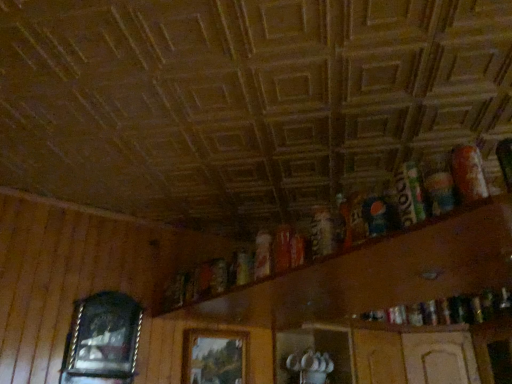
Question: Is wooden shelf at upper right, the 1th shelf from the right, at the right side of wooden picture frame at left, the 1th picture frame from the left?

Choices:
 (A) no
 (B) yes

Answer: (B)

Question: Can we say wooden shelf at upper right, the 2th shelf in the left-to-right sequence, lies outside wooden picture frame at left, the 1th picture frame from the left?

Choices:
 (A) no
 (B) yes

Answer: (B)

Question: Is wooden shelf at upper right, the 1th shelf from the right, in front of wooden picture frame at left, which is the 2th picture frame from right to left?

Choices:
 (A) no
 (B) yes

Answer: (B)

Question: From a real-world perspective, is wooden shelf at upper right, the 2th shelf in the left-to-right sequence, positioned under wooden picture frame at left, the 1th picture frame from the left, based on gravity?

Choices:
 (A) no
 (B) yes

Answer: (A)

Question: Considering the relative sizes of wooden shelf at upper right, the 2th shelf in the left-to-right sequence, and wooden picture frame at left, the 1th picture frame from the left, in the image provided, is wooden shelf at upper right, the 2th shelf in the left-to-right sequence, shorter than wooden picture frame at left, the 1th picture frame from the left,?

Choices:
 (A) yes
 (B) no

Answer: (A)

Question: From the image's perspective, is wooden shelf at upper right, the 1th shelf from the right, above or below wooden cabinet at lower center, marked as the 2th shelf in a right-to-left arrangement?

Choices:
 (A) below
 (B) above

Answer: (B)

Question: From a real-world perspective, is wooden shelf at upper right, the 1th shelf from the right, above or below wooden cabinet at lower center, which ranks as the first shelf in left-to-right order?

Choices:
 (A) below
 (B) above

Answer: (B)

Question: Relative to wooden cabinet at lower center, marked as the 2th shelf in a right-to-left arrangement, is wooden shelf at upper right, the 1th shelf from the right, in front or behind?

Choices:
 (A) front
 (B) behind

Answer: (A)

Question: In terms of width, does wooden shelf at upper right, the 1th shelf from the right, look wider or thinner when compared to wooden cabinet at lower center, marked as the 2th shelf in a right-to-left arrangement?

Choices:
 (A) thin
 (B) wide

Answer: (B)

Question: From a real-world perspective, is wooden cabinet at lower center, marked as the 2th shelf in a right-to-left arrangement, positioned above or below wooden picture frame at left, the 1th picture frame from the left?

Choices:
 (A) above
 (B) below

Answer: (B)

Question: Considering the positions of wooden cabinet at lower center, which ranks as the first shelf in left-to-right order, and wooden picture frame at left, which is the 2th picture frame from right to left, in the image, is wooden cabinet at lower center, which ranks as the first shelf in left-to-right order, taller or shorter than wooden picture frame at left, which is the 2th picture frame from right to left,?

Choices:
 (A) tall
 (B) short

Answer: (B)

Question: Is wooden cabinet at lower center, marked as the 2th shelf in a right-to-left arrangement, wider or thinner than wooden picture frame at left, the 1th picture frame from the left?

Choices:
 (A) thin
 (B) wide

Answer: (B)

Question: From the image's perspective, is wooden cabinet at lower center, which ranks as the first shelf in left-to-right order, above or below wooden picture frame at left, the 1th picture frame from the left?

Choices:
 (A) below
 (B) above

Answer: (A)

Question: Looking at the image, does wooden picture frame at left, which is the 2th picture frame from right to left, seem bigger or smaller compared to wooden shelf at upper right, the 1th shelf from the right?

Choices:
 (A) small
 (B) big

Answer: (A)

Question: From the image's perspective, is wooden picture frame at left, the 1th picture frame from the left, located above or below wooden shelf at upper right, the 2th shelf in the left-to-right sequence?

Choices:
 (A) below
 (B) above

Answer: (A)